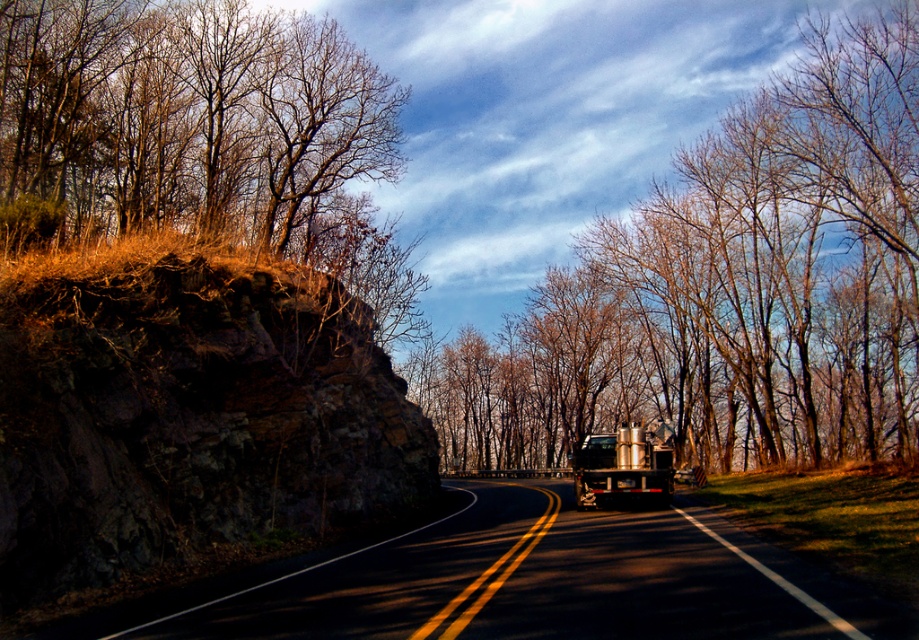
You are driving a car that is 15 feet long. You need to make a U turn on the road between the bare branches at center and the rocky cliff at left. Is there enough space for your car to complete the U turn?

The distance between the bare branches at center and the rocky cliff at left is 82.39 feet. Since your car is only 15 feet long, there is more than enough space to make a U turn between them.

You are driving along the scenic road and want to reach a destination located at point (647, 333). Your current position is at point (179, 294). According to the image, is your destination ahead of you or behind you?

Point (647, 333) is behind point (179, 294), so your destination is behind you.